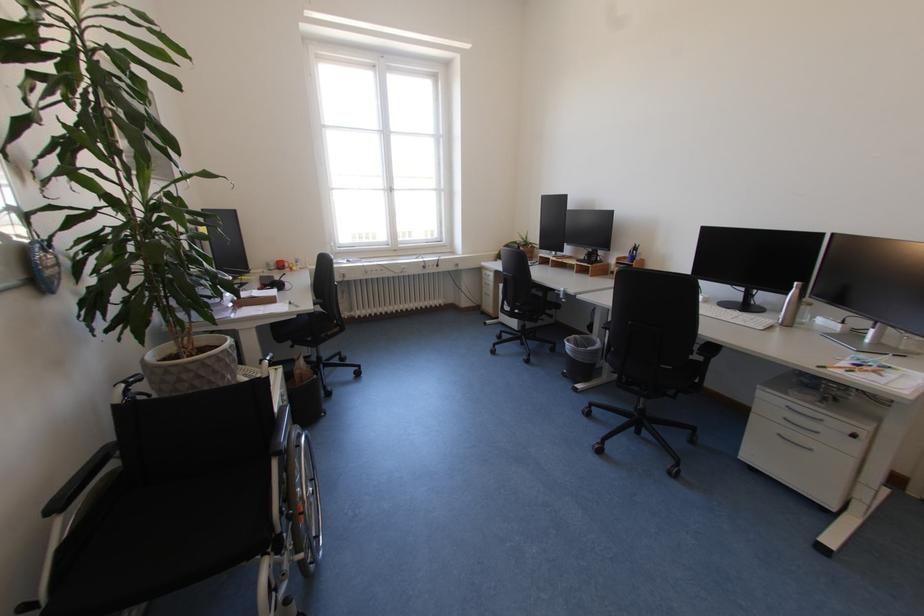
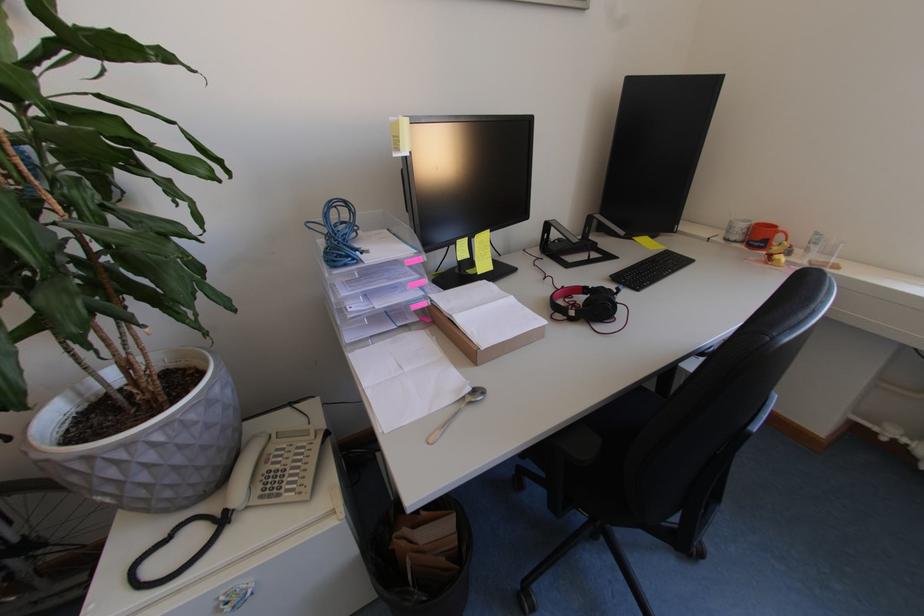
Question: I am providing you with two images of the same scene from different viewpoints. Please identify which objects are invisible in image2.

Choices:
 (A) small cabinet handle
 (B) metal spoon
 (C) white telephone handset
 (D) none of these

Answer: (D)